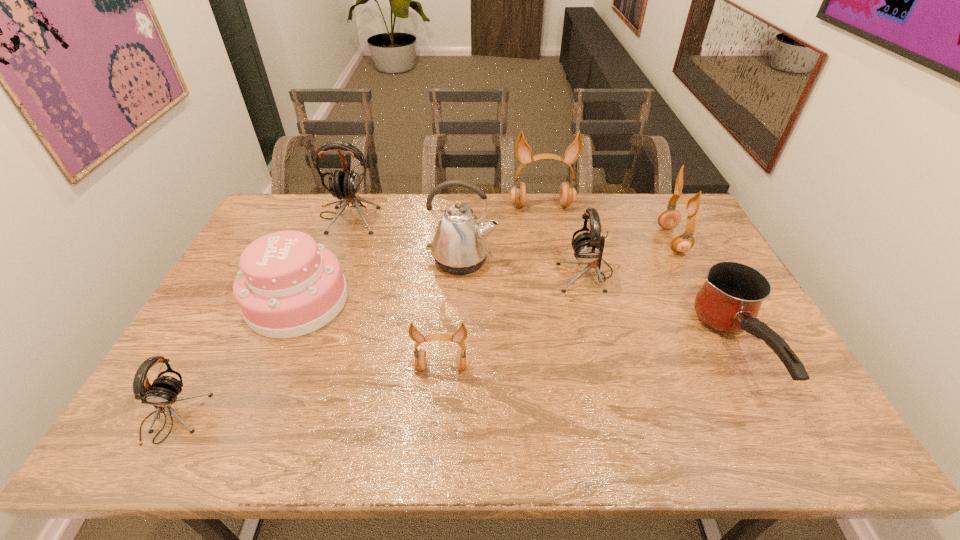
You are a GUI agent. You are given a task and a screenshot of the screen. Output one action in this format:
    pyautogui.click(x=<x>, y=<y>)
    Task: Click on the smallest brown earphone
    This screenshot has width=960, height=540.
    Given the screenshot: What is the action you would take?
    pyautogui.click(x=419, y=358)

This screenshot has width=960, height=540. What are the coordinates of `the fourth earphone from right to left` in the screenshot? It's located at (419, 358).

At what (x,y) coordinates should I click in order to perform the action: click on the nearest earphone. Please return your answer as a coordinate pair (x, y). The image size is (960, 540). Looking at the image, I should click on (163, 392).

The width and height of the screenshot is (960, 540). I want to click on the leftmost earphone, so click(163, 392).

Identify the location of saucepan. Image resolution: width=960 pixels, height=540 pixels. (729, 301).

The width and height of the screenshot is (960, 540). In order to click on vacant space located on the front-facing side of the second brown earphone from right to left in this screenshot , I will do `click(553, 268)`.

Where is `free region located 0.210m on the front of the second black earphone from right to left`? This screenshot has width=960, height=540. free region located 0.210m on the front of the second black earphone from right to left is located at coordinates (325, 276).

At what (x,y) coordinates should I click in order to perform the action: click on free space located 0.230m on the back of the kettle. Please return your answer as a coordinate pair (x, y). The width and height of the screenshot is (960, 540). Looking at the image, I should click on (465, 204).

Locate an element on the screen. vacant space located on the left of the rightmost black earphone is located at coordinates (439, 273).

I want to click on vacant space located 0.050m on the front-facing side of the second biggest brown earphone, so (x=646, y=240).